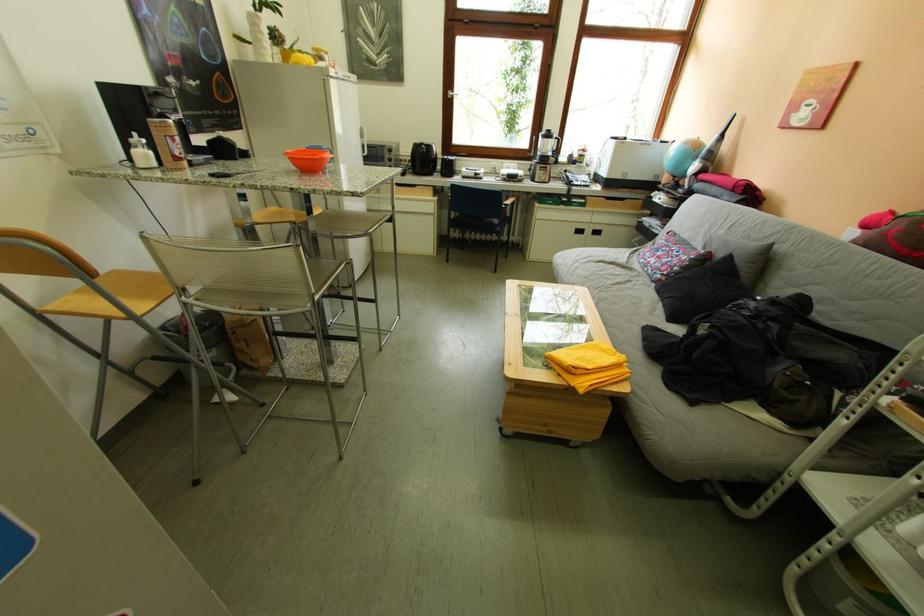
Find where to push the pump bottle dispenser. Please return your answer as a coordinate pair (x, y).

(140, 143)